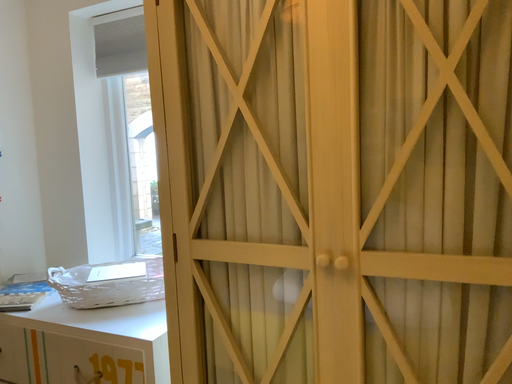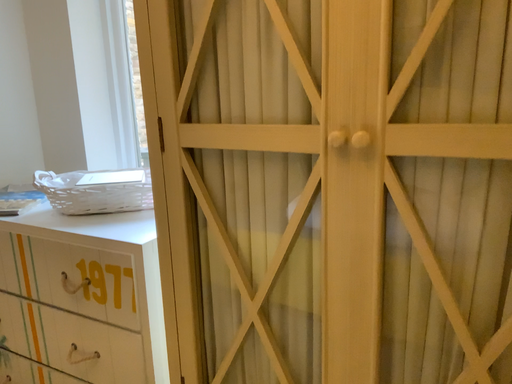
Question: How did the camera likely rotate when shooting the video?

Choices:
 (A) rotated upward
 (B) rotated downward

Answer: (B)